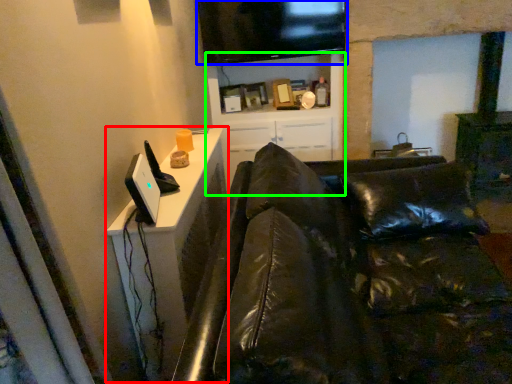
Question: Which object is the closest to the dresser (highlighted by a red box)? Choose among these: television (highlighted by a blue box) or entertainment center (highlighted by a green box).

Choices:
 (A) television
 (B) entertainment center

Answer: (A)